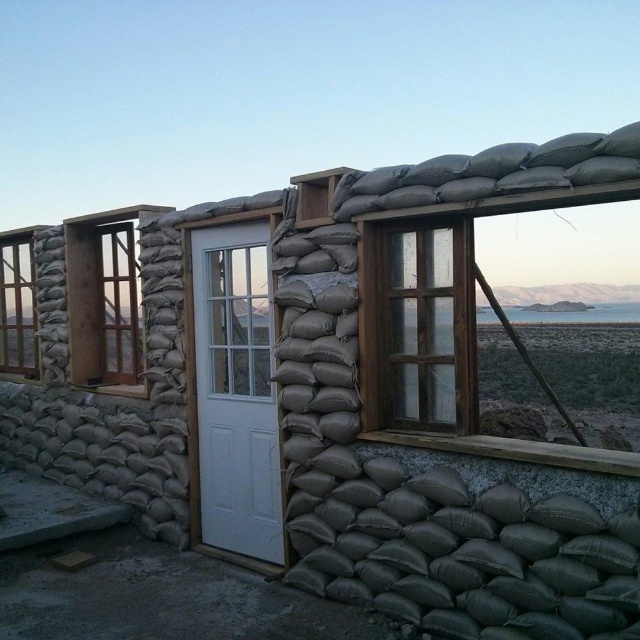
Is the position of wooden-framed glass window at upper center more distant than that of wooden at left?

No, wooden-framed glass window at upper center is closer to the viewer.

Is point (468, 372) positioned in front of point (1, 301)?

Yes, it is.

Identify the location of wooden-framed glass window at upper center. (458, 333).

Can you confirm if white matte door at center is shorter than wooden at left?

No, white matte door at center is not shorter than wooden at left.

Is white matte door at center positioned in front of wooden at left?

Yes, white matte door at center is closer to the viewer.

Between point (195, 321) and point (17, 356), which one is positioned behind?

Positioned behind is point (17, 356).

Identify the location of white matte door at center. (236, 390).

Measure the distance from white matte door at center to gray sandbags at upper center.

6.08 feet

Between white matte door at center and gray sandbags at upper center, which one appears on the left side from the viewer's perspective?

white matte door at center is more to the left.

Does point (221, 364) come farther from viewer compared to point (566, 157)?

Yes, it is.

What are the coordinates of `white matte door at center` in the screenshot? It's located at (236, 390).